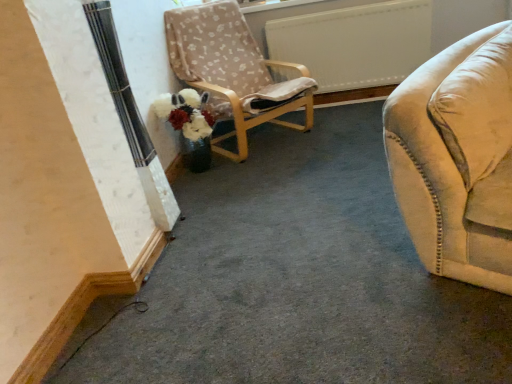
Identify the location of beige fabric chair at center. (233, 71).

What do you see at coordinates (233, 71) in the screenshot? I see `beige fabric chair at center` at bounding box center [233, 71].

Identify the location of white fluffy flower at center. This screenshot has width=512, height=384. (186, 113).

Image resolution: width=512 pixels, height=384 pixels. What do you see at coordinates (186, 113) in the screenshot?
I see `white fluffy flower at center` at bounding box center [186, 113].

At what (x,y) coordinates should I click in order to perform the action: click on beige fabric chair at center. Please return your answer as a coordinate pair (x, y). The height and width of the screenshot is (384, 512). Looking at the image, I should click on (233, 71).

In the image, is white fluffy flower at center on the left side or the right side of beige fabric chair at center?

In the image, white fluffy flower at center appears on the left side of beige fabric chair at center.

Considering the positions of objects white fluffy flower at center and beige fabric chair at center in the image provided, who is behind, white fluffy flower at center or beige fabric chair at center?

Positioned behind is white fluffy flower at center.

In the scene shown: Which point is more forward, (169, 114) or (244, 91)?

The point (169, 114) is closer.

From the image's perspective, is white fluffy flower at center above or below beige fabric chair at center?

Based on their image positions, white fluffy flower at center is located beneath beige fabric chair at center.

Looking at this image, from a real-world perspective, between white fluffy flower at center and beige fabric chair at center, who is vertically lower?

In real-world perspective, white fluffy flower at center is lower.

Does white fluffy flower at center have a lesser width compared to beige fabric chair at center?

Correct, the width of white fluffy flower at center is less than that of beige fabric chair at center.

From their relative heights in the image, would you say white fluffy flower at center is taller or shorter than beige fabric chair at center?

In the image, white fluffy flower at center appears to be shorter than beige fabric chair at center.

Considering the relative sizes of white fluffy flower at center and beige fabric chair at center in the image provided, is white fluffy flower at center bigger than beige fabric chair at center?

No.

Is beige fabric chair at center inside white fluffy flower at center?

Definitely not — beige fabric chair at center is not inside white fluffy flower at center.

Is white fluffy flower at center placed right next to beige fabric chair at center?

white fluffy flower at center and beige fabric chair at center are clearly separated.

Is white fluffy flower at center facing away from beige fabric chair at center?

white fluffy flower at center is not turned away from beige fabric chair at center.

How many degrees apart are the facing directions of white fluffy flower at center and beige fabric chair at center?

47.3 degrees separate the facing orientations of white fluffy flower at center and beige fabric chair at center.

How distant is white fluffy flower at center from beige fabric chair at center?

white fluffy flower at center and beige fabric chair at center are 15.98 inches apart from each other.

Find the location of a particular element. flower lying below the beige fabric chair at center (from the image's perspective) is located at coordinates (186, 113).

Between beige fabric chair at center and white fluffy flower at center, which one appears on the right side from the viewer's perspective?

beige fabric chair at center is more to the right.

Is beige fabric chair at center in front of or behind white fluffy flower at center in the image?

Visually, beige fabric chair at center is located in front of white fluffy flower at center.

Which is farther from the camera, (173,58) or (204,125)?

Point (173,58)

From the image's perspective, relative to white fluffy flower at center, is beige fabric chair at center above or below?

Clearly, from the image's perspective, beige fabric chair at center is above white fluffy flower at center.

From a real-world perspective, is beige fabric chair at center physically below white fluffy flower at center?

No, from a real-world perspective, beige fabric chair at center is not beneath white fluffy flower at center.

Does beige fabric chair at center have a greater width compared to white fluffy flower at center?

Indeed, beige fabric chair at center has a greater width compared to white fluffy flower at center.

Which of these two, beige fabric chair at center or white fluffy flower at center, stands taller?

beige fabric chair at center.

In the scene shown: Who is bigger, beige fabric chair at center or white fluffy flower at center?

beige fabric chair at center is bigger.

Choose the correct answer: Is beige fabric chair at center inside white fluffy flower at center or outside it?

beige fabric chair at center is outside white fluffy flower at center.

Is beige fabric chair at center with white fluffy flower at center?

No, beige fabric chair at center is not making contact with white fluffy flower at center.

Is beige fabric chair at center oriented away from white fluffy flower at center?

No, beige fabric chair at center is not facing the opposite direction of white fluffy flower at center.

I want to click on chair on the right of white fluffy flower at center, so click(233, 71).

Find the location of a particular element. chair that appears on the right of white fluffy flower at center is located at coordinates (233, 71).

Where is `chair located above the white fluffy flower at center (from a real-world perspective)`? chair located above the white fluffy flower at center (from a real-world perspective) is located at coordinates (233, 71).